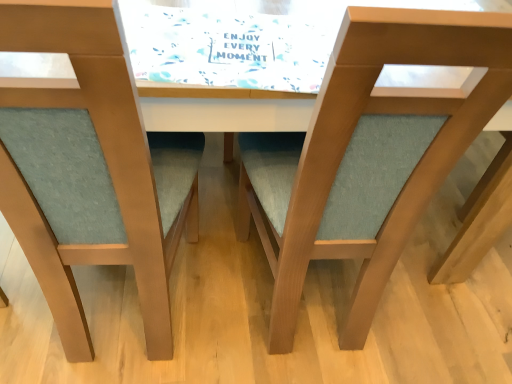
Identify the location of matte wood chair at center, acting as the 1th chair starting from the right. (369, 153).

What is the approximate width of matte wood chair at center, arranged as the second chair when viewed from the left?

It is 19.78 inches.

In the scene shown: Measure the distance between point (357,220) and camera.

They are 36.61 inches apart.

What do you see at coordinates (369, 153) in the screenshot? Image resolution: width=512 pixels, height=384 pixels. I see `matte wood chair at center, arranged as the second chair when viewed from the left` at bounding box center [369, 153].

You are a GUI agent. You are given a task and a screenshot of the screen. Output one action in this format:
    pyautogui.click(x=<x>, y=<y>)
    Task: Click on the matte wood chair at center, positioned as the first chair in left-to-right order
    
    Given the screenshot: What is the action you would take?
    pyautogui.click(x=92, y=169)

What do you see at coordinates (92, 169) in the screenshot?
I see `matte wood chair at center, positioned as the first chair in left-to-right order` at bounding box center [92, 169].

How much space does matte wood chair at center, positioned as the 2th chair in right-to-left order, occupy horizontally?

53.05 centimeters.

I want to click on matte wood chair at center, arranged as the second chair when viewed from the left, so click(x=369, y=153).

Between matte wood chair at center, acting as the 1th chair starting from the right, and matte wood chair at center, positioned as the first chair in left-to-right order, which one appears on the left side from the viewer's perspective?

From the viewer's perspective, matte wood chair at center, positioned as the first chair in left-to-right order, appears more on the left side.

Is matte wood chair at center, acting as the 1th chair starting from the right, closer to camera compared to matte wood chair at center, positioned as the 2th chair in right-to-left order?

No, matte wood chair at center, acting as the 1th chair starting from the right, is further to the viewer.

Which is nearer, [385,159] or [154,214]?

The point [385,159] is closer to the camera.

From the image's perspective, who appears lower, matte wood chair at center, arranged as the second chair when viewed from the left, or matte wood chair at center, positioned as the 2th chair in right-to-left order?

matte wood chair at center, arranged as the second chair when viewed from the left.

From a real-world perspective, is matte wood chair at center, arranged as the second chair when viewed from the left, located beneath matte wood chair at center, positioned as the 2th chair in right-to-left order?

Yes, from a real-world perspective, matte wood chair at center, arranged as the second chair when viewed from the left, is under matte wood chair at center, positioned as the 2th chair in right-to-left order.

In terms of width, does matte wood chair at center, acting as the 1th chair starting from the right, look wider or thinner when compared to matte wood chair at center, positioned as the 2th chair in right-to-left order?

Clearly, matte wood chair at center, acting as the 1th chair starting from the right, has less width compared to matte wood chair at center, positioned as the 2th chair in right-to-left order.

Can you confirm if matte wood chair at center, acting as the 1th chair starting from the right, is taller than matte wood chair at center, positioned as the first chair in left-to-right order?

No.

Considering the sizes of matte wood chair at center, arranged as the second chair when viewed from the left, and matte wood chair at center, positioned as the 2th chair in right-to-left order, in the image, is matte wood chair at center, arranged as the second chair when viewed from the left, bigger or smaller than matte wood chair at center, positioned as the 2th chair in right-to-left order,?

In the image, matte wood chair at center, arranged as the second chair when viewed from the left, appears to be smaller than matte wood chair at center, positioned as the 2th chair in right-to-left order.

Does matte wood chair at center, acting as the 1th chair starting from the right, contain matte wood chair at center, positioned as the first chair in left-to-right order?

Actually, matte wood chair at center, positioned as the first chair in left-to-right order, is outside matte wood chair at center, acting as the 1th chair starting from the right.

Consider the image. Is matte wood chair at center, arranged as the second chair when viewed from the left, touching matte wood chair at center, positioned as the 2th chair in right-to-left order?

matte wood chair at center, arranged as the second chair when viewed from the left, and matte wood chair at center, positioned as the 2th chair in right-to-left order, are clearly separated.

In the scene shown: Is matte wood chair at center, acting as the 1th chair starting from the right, oriented away from matte wood chair at center, positioned as the first chair in left-to-right order?

No, matte wood chair at center, acting as the 1th chair starting from the right, is not facing away from matte wood chair at center, positioned as the first chair in left-to-right order.

How many degrees apart are the facing directions of matte wood chair at center, acting as the 1th chair starting from the right, and matte wood chair at center, positioned as the 2th chair in right-to-left order?

matte wood chair at center, acting as the 1th chair starting from the right, and matte wood chair at center, positioned as the 2th chair in right-to-left order, are facing 4.83e-06 degrees away from each other.

At what (x,y) coordinates should I click in order to perform the action: click on chair to the right of matte wood chair at center, positioned as the first chair in left-to-right order. Please return your answer as a coordinate pair (x, y). Image resolution: width=512 pixels, height=384 pixels. Looking at the image, I should click on (369, 153).

Considering the positions of objects matte wood chair at center, positioned as the 2th chair in right-to-left order, and matte wood chair at center, arranged as the second chair when viewed from the left, in the image provided, who is more to the right, matte wood chair at center, positioned as the 2th chair in right-to-left order, or matte wood chair at center, arranged as the second chair when viewed from the left,?

matte wood chair at center, arranged as the second chair when viewed from the left, is more to the right.

Which object is further away from the camera, matte wood chair at center, positioned as the 2th chair in right-to-left order, or matte wood chair at center, acting as the 1th chair starting from the right?

matte wood chair at center, acting as the 1th chair starting from the right, is behind.

Considering the positions of point (32, 97) and point (360, 285), is point (32, 97) closer or farther from the camera than point (360, 285)?

Clearly, point (32, 97) is closer to the camera than point (360, 285).

From the image's perspective, between matte wood chair at center, positioned as the first chair in left-to-right order, and matte wood chair at center, arranged as the second chair when viewed from the left, who is located below?

matte wood chair at center, arranged as the second chair when viewed from the left, is shown below in the image.

From a real-world perspective, is matte wood chair at center, positioned as the 2th chair in right-to-left order, under matte wood chair at center, acting as the 1th chair starting from the right?

No, from a real-world perspective, matte wood chair at center, positioned as the 2th chair in right-to-left order, is not under matte wood chair at center, acting as the 1th chair starting from the right.

In terms of width, does matte wood chair at center, positioned as the 2th chair in right-to-left order, look wider or thinner when compared to matte wood chair at center, acting as the 1th chair starting from the right?

In the image, matte wood chair at center, positioned as the 2th chair in right-to-left order, appears to be wider than matte wood chair at center, acting as the 1th chair starting from the right.

Which of these two, matte wood chair at center, positioned as the first chair in left-to-right order, or matte wood chair at center, arranged as the second chair when viewed from the left, stands taller?

With more height is matte wood chair at center, positioned as the first chair in left-to-right order.

Who is bigger, matte wood chair at center, positioned as the 2th chair in right-to-left order, or matte wood chair at center, arranged as the second chair when viewed from the left?

matte wood chair at center, positioned as the 2th chair in right-to-left order, is bigger.

Can we say matte wood chair at center, positioned as the first chair in left-to-right order, lies outside matte wood chair at center, acting as the 1th chair starting from the right?

matte wood chair at center, positioned as the first chair in left-to-right order, lies outside matte wood chair at center, acting as the 1th chair starting from the right,'s area.

Is there a large distance between matte wood chair at center, positioned as the first chair in left-to-right order, and matte wood chair at center, arranged as the second chair when viewed from the left?

Result: No, there isn't a large distance between matte wood chair at center, positioned as the first chair in left-to-right order, and matte wood chair at center, arranged as the second chair when viewed from the left.

Is matte wood chair at center, positioned as the 2th chair in right-to-left order, facing towards matte wood chair at center, acting as the 1th chair starting from the right?

No, matte wood chair at center, positioned as the 2th chair in right-to-left order, is not facing towards matte wood chair at center, acting as the 1th chair starting from the right.

Can you tell me how much matte wood chair at center, positioned as the first chair in left-to-right order, and matte wood chair at center, acting as the 1th chair starting from the right, differ in facing direction?

They differ by 4.83e-06 degrees in their facing directions.

This screenshot has width=512, height=384. Find the location of `chair on the right of the matte wood chair at center, positioned as the first chair in left-to-right order`. chair on the right of the matte wood chair at center, positioned as the first chair in left-to-right order is located at coordinates (369, 153).

Locate an element on the screen. The height and width of the screenshot is (384, 512). chair above the matte wood chair at center, arranged as the second chair when viewed from the left (from a real-world perspective) is located at coordinates (92, 169).

Find the location of a particular element. The height and width of the screenshot is (384, 512). chair in front of the matte wood chair at center, arranged as the second chair when viewed from the left is located at coordinates (92, 169).